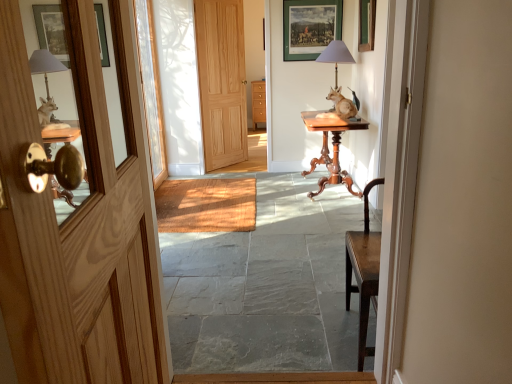
What do you see at coordinates (343, 103) in the screenshot? This screenshot has height=384, width=512. I see `brown wooden statue at center` at bounding box center [343, 103].

The height and width of the screenshot is (384, 512). What do you see at coordinates (206, 205) in the screenshot? I see `wooden at center` at bounding box center [206, 205].

Describe the element at coordinates (310, 27) in the screenshot. I see `matte green picture frame at upper center` at that location.

Measure the distance between natural wood door at center, arranged as the 2th door when viewed from the front, and camera.

The distance of natural wood door at center, arranged as the 2th door when viewed from the front, from camera is 4.45 meters.

At what (x,y) coordinates should I click in order to perform the action: click on natural wood door at center, the second door ordered from the bottom. Please return your answer as a coordinate pair (x, y). Looking at the image, I should click on (221, 81).

The width and height of the screenshot is (512, 384). Find the location of `brown wooden statue at center`. brown wooden statue at center is located at coordinates (343, 103).

Does clear glass door at center appear on the left side of smooth stone floor at center?

Indeed, clear glass door at center is positioned on the left side of smooth stone floor at center.

From a real-world perspective, who is located higher, clear glass door at center or smooth stone floor at center?

clear glass door at center.

Is clear glass door at center next to smooth stone floor at center?

No, clear glass door at center is not next to smooth stone floor at center.

Which of these two, clear glass door at center or smooth stone floor at center, stands taller?

With more height is clear glass door at center.

How many degrees apart are the facing directions of wooden door at left, the first door ordered from the bottom, and smooth stone floor at center?

The angle between the facing direction of wooden door at left, the first door ordered from the bottom, and the facing direction of smooth stone floor at center is 91.3 degrees.

Which is in front, point (50, 126) or point (240, 269)?

The point (50, 126) is closer to the camera.

Who is shorter, wooden door at left, the first door ordered from the bottom, or smooth stone floor at center?

smooth stone floor at center is shorter.

Would you consider wooden door at left, the 2th door when ordered from back to front, to be distant from smooth stone floor at center?

Yes, wooden door at left, the 2th door when ordered from back to front, and smooth stone floor at center are quite far apart.

Can you confirm if natural wood door at center, marked as the first door in a top-to-bottom arrangement, is shorter than mahogany wood table at center?

In fact, natural wood door at center, marked as the first door in a top-to-bottom arrangement, may be taller than mahogany wood table at center.

Which object is further away from the camera taking this photo, natural wood door at center, marked as the first door in a top-to-bottom arrangement, or mahogany wood table at center?

natural wood door at center, marked as the first door in a top-to-bottom arrangement, is further away from the camera.

From a real-world perspective, count 2nd doors upward from the mahogany wood table at center and point to it. Please provide its 2D coordinates.

[(221, 81)]

Is natural wood door at center, arranged as the 2th door when viewed from the front, oriented towards mahogany wood table at center?

Yes, natural wood door at center, arranged as the 2th door when viewed from the front, faces towards mahogany wood table at center.

Considering the sizes of wooden at center and smooth stone floor at center in the image, is wooden at center bigger or smaller than smooth stone floor at center?

Clearly, wooden at center is smaller in size than smooth stone floor at center.

Find the location of a particular element. This screenshot has width=512, height=384. path below the wooden at center (from a real-world perspective) is located at coordinates (266, 285).

Can you confirm if wooden at center is taller than smooth stone floor at center?

No.

In terms of width, does matte green picture frame at upper center look wider or thinner when compared to wooden at center?

matte green picture frame at upper center is thinner than wooden at center.

Can you tell me how much matte green picture frame at upper center and wooden at center differ in facing direction?

91.3 degrees separate the facing orientations of matte green picture frame at upper center and wooden at center.

You are a GUI agent. You are given a task and a screenshot of the screen. Output one action in this format:
    pyautogui.click(x=<x>, y=<y>)
    Task: Click on the doormat below the matte green picture frame at upper center (from a real-world perspective)
    The height and width of the screenshot is (384, 512).
    Given the screenshot: What is the action you would take?
    pyautogui.click(x=206, y=205)

Choose the correct answer: Is matte green picture frame at upper center inside wooden at center or outside it?

matte green picture frame at upper center is spatially situated outside wooden at center.

Which object is thinner, wooden at center or matte gray lampshade at upper center?

matte gray lampshade at upper center.

Between wooden at center and matte gray lampshade at upper center, which one is positioned in front?

wooden at center is closer to the camera.

From a real-world perspective, is wooden at center above or below matte gray lampshade at upper center?

wooden at center is situated lower than matte gray lampshade at upper center in the real world.

Based on the photo, looking at their sizes, would you say clear glass door at center is wider or thinner than wooden at center?

Considering their sizes, clear glass door at center looks slimmer than wooden at center.

Considering the relative sizes of clear glass door at center and wooden at center in the image provided, is clear glass door at center shorter than wooden at center?

Incorrect, the height of clear glass door at center does not fall short of that of wooden at center.

Is clear glass door at center further to the viewer compared to wooden at center?

Yes, clear glass door at center is behind wooden at center.

In the scene shown: From a real-world perspective, between clear glass door at center and wooden at center, who is vertically higher?

From a 3D spatial view, clear glass door at center is above.

The width and height of the screenshot is (512, 384). Identify the location of glass door above the smooth stone floor at center (from a real-world perspective). (151, 89).

This screenshot has height=384, width=512. I want to click on the 1st door counting from the left of the smooth stone floor at center, so click(x=77, y=209).

From the image, which object appears to be nearer to smooth stone floor at center, clear glass door at center or matte green picture frame at upper center?

Based on the image, clear glass door at center appears to be nearer to smooth stone floor at center.

Considering their positions, is brown wooden statue at center positioned further to wooden at center than natural wood door at center, marked as the first door in a top-to-bottom arrangement?

Based on the image, brown wooden statue at center appears to be further to wooden at center.

Considering their positions, is wooden door at left, the first door viewed from the front, positioned further to natural wood door at center, the first door in the back-to-front sequence, than clear glass door at center?

wooden door at left, the first door viewed from the front, lies further to natural wood door at center, the first door in the back-to-front sequence, than the other object.

Estimate the real-world distances between objects in this image. Which object is further from smooth stone floor at center, clear glass door at center or natural wood door at center, arranged as the 2th door when viewed from the front?

The object further to smooth stone floor at center is natural wood door at center, arranged as the 2th door when viewed from the front.

When comparing their distances from mahogany wood table at center, does smooth stone floor at center or clear glass door at center seem further?

clear glass door at center is further to mahogany wood table at center.

From the image, which object appears to be nearer to smooth stone floor at center, brown wooden statue at center or clear glass door at center?

brown wooden statue at center is closer to smooth stone floor at center.

Based on their spatial positions, is matte green picture frame at upper center or smooth stone floor at center closer to brown wooden statue at center?

matte green picture frame at upper center lies closer to brown wooden statue at center than the other object.

When comparing their distances from mahogany wood table at center, does natural wood door at center, the first door in the back-to-front sequence, or matte green picture frame at upper center seem closer?

Based on the image, matte green picture frame at upper center appears to be nearer to mahogany wood table at center.

Locate an element on the screen. This screenshot has width=512, height=384. open between smooth stone floor at center and clear glass door at center in the front-back direction is located at coordinates click(x=343, y=103).

Where is `open positioned between wooden door at left, the first door ordered from the bottom, and matte green picture frame at upper center from near to far`? The height and width of the screenshot is (384, 512). open positioned between wooden door at left, the first door ordered from the bottom, and matte green picture frame at upper center from near to far is located at coordinates (343, 103).

Find the location of `doormat positioned between wooden door at left, the 2th door when ordered from back to front, and natural wood door at center, marked as the first door in a top-to-bottom arrangement, from near to far`. doormat positioned between wooden door at left, the 2th door when ordered from back to front, and natural wood door at center, marked as the first door in a top-to-bottom arrangement, from near to far is located at coordinates (206, 205).

Locate an element on the screen. This screenshot has height=384, width=512. open between wooden door at left, the first door viewed from the front, and clear glass door at center from front to back is located at coordinates (343, 103).